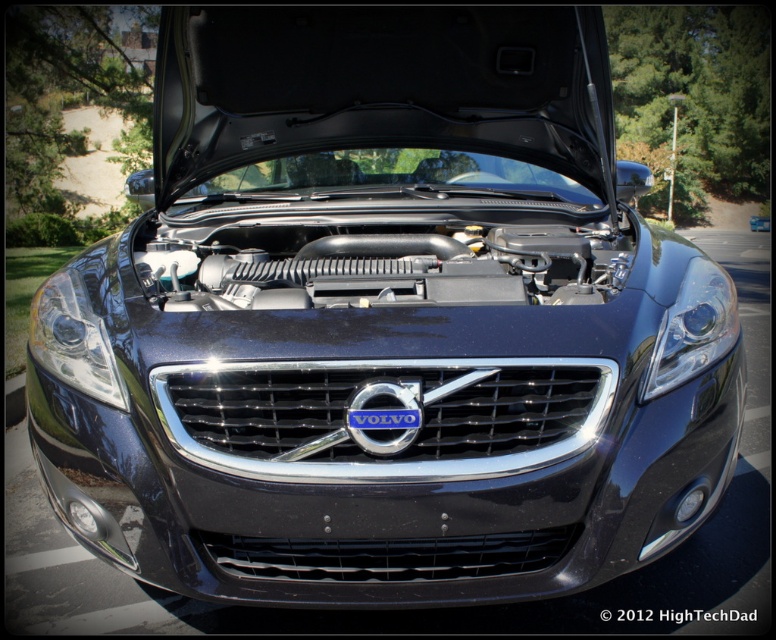
Who is more forward, (95, 330) or (376, 419)?

Positioned in front is point (376, 419).

Is satin black headlight at center wider than blue metallic volvo emblem at center?

Correct, the width of satin black headlight at center exceeds that of blue metallic volvo emblem at center.

I want to click on satin black headlight at center, so click(x=73, y=339).

At what (x,y) coordinates should I click in order to perform the action: click on satin black headlight at center. Please return your answer as a coordinate pair (x, y). The height and width of the screenshot is (640, 776). Looking at the image, I should click on (73, 339).

Is point (92, 349) less distant than point (688, 280)?

Yes, point (92, 349) is in front of point (688, 280).

Does satin black headlight at center have a greater height compared to satin black headlight at center right?

Indeed, satin black headlight at center has a greater height compared to satin black headlight at center right.

Is point (52, 307) farther from viewer compared to point (669, 380)?

Yes, point (52, 307) is behind point (669, 380).

This screenshot has width=776, height=640. What are the coordinates of `satin black headlight at center` in the screenshot? It's located at (73, 339).

Does satin black headlight at center right appear on the right side of blue metallic volvo emblem at center?

Indeed, satin black headlight at center right is positioned on the right side of blue metallic volvo emblem at center.

Find the location of a particular element. This screenshot has width=776, height=640. satin black headlight at center right is located at coordinates (693, 328).

Locate an element on the screen. The width and height of the screenshot is (776, 640). satin black headlight at center right is located at coordinates (693, 328).